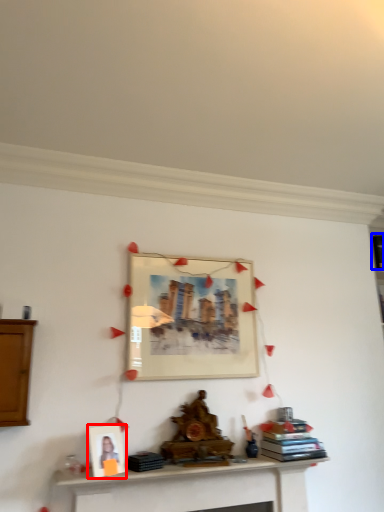
Question: Among these objects, which one is nearest to the camera, picture frame (highlighted by a red box) or book (highlighted by a blue box)?

Choices:
 (A) picture frame
 (B) book

Answer: (A)